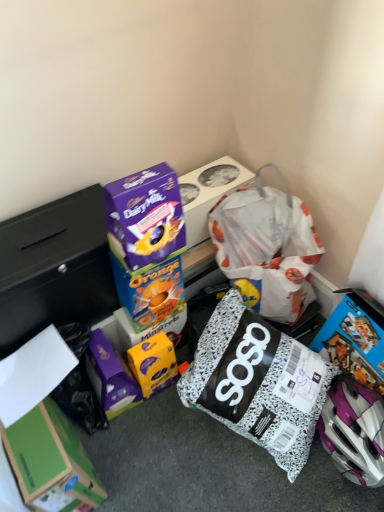
Question: Is yellow matte chocolate bar at center, the 2th box when ordered from bottom to top, looking in the opposite direction of white matte paper at lower left?

Choices:
 (A) no
 (B) yes

Answer: (A)

Question: Does yellow matte chocolate bar at center, the 2th box when ordered from bottom to top, touch white matte paper at lower left?

Choices:
 (A) no
 (B) yes

Answer: (A)

Question: Can you confirm if yellow matte chocolate bar at center, the 2th box when ordered from bottom to top, is smaller than white matte paper at lower left?

Choices:
 (A) yes
 (B) no

Answer: (B)

Question: From a real-world perspective, is yellow matte chocolate bar at center, the 2th box when ordered from bottom to top, located beneath white matte paper at lower left?

Choices:
 (A) yes
 (B) no

Answer: (A)

Question: From the image's perspective, would you say yellow matte chocolate bar at center, which is the fourth box from top to bottom, is shown under white matte paper at lower left?

Choices:
 (A) no
 (B) yes

Answer: (B)

Question: Is speckled fabric diaper bag at center spatially inside blue cardboard box at center, which appears as the third box when viewed from the top, or outside of it?

Choices:
 (A) inside
 (B) outside

Answer: (B)

Question: In terms of width, does speckled fabric diaper bag at center look wider or thinner when compared to blue cardboard box at center, the 3th box ordered from the bottom?

Choices:
 (A) thin
 (B) wide

Answer: (B)

Question: Is point (183, 384) closer or farther from the camera than point (140, 300)?

Choices:
 (A) farther
 (B) closer

Answer: (A)

Question: Considering their positions, is speckled fabric diaper bag at center located in front of or behind blue cardboard box at center, the 3th box ordered from the bottom?

Choices:
 (A) behind
 (B) front

Answer: (B)

Question: In terms of size, does purple glossy chocolate bar at upper center, positioned as the fourth box in bottom-to-top order, appear bigger or smaller than purple cardboard dairy milk chocolate bar at upper center, the fifth box in the bottom-to-top sequence?

Choices:
 (A) small
 (B) big

Answer: (A)

Question: Is purple glossy chocolate bar at upper center, positioned as the fourth box in bottom-to-top order, inside or outside of purple cardboard dairy milk chocolate bar at upper center, the fifth box in the bottom-to-top sequence?

Choices:
 (A) outside
 (B) inside

Answer: (A)

Question: From the image's perspective, is purple glossy chocolate bar at upper center, which is counted as the 2th box, starting from the top, above or below purple cardboard dairy milk chocolate bar at upper center, the fifth box in the bottom-to-top sequence?

Choices:
 (A) below
 (B) above

Answer: (A)

Question: Would you say purple glossy chocolate bar at upper center, positioned as the fourth box in bottom-to-top order, is to the left or to the right of purple cardboard dairy milk chocolate bar at upper center, the fifth box in the bottom-to-top sequence, in the picture?

Choices:
 (A) left
 (B) right

Answer: (A)

Question: From the image's perspective, is blue cardboard box at center, which appears as the third box when viewed from the top, located above or below purple cardboard dairy milk chocolate bar at upper center, the fifth box in the bottom-to-top sequence?

Choices:
 (A) above
 (B) below

Answer: (B)

Question: Is blue cardboard box at center, which appears as the third box when viewed from the top, taller or shorter than purple cardboard dairy milk chocolate bar at upper center, arranged as the 1th box when viewed from the top?

Choices:
 (A) short
 (B) tall

Answer: (B)